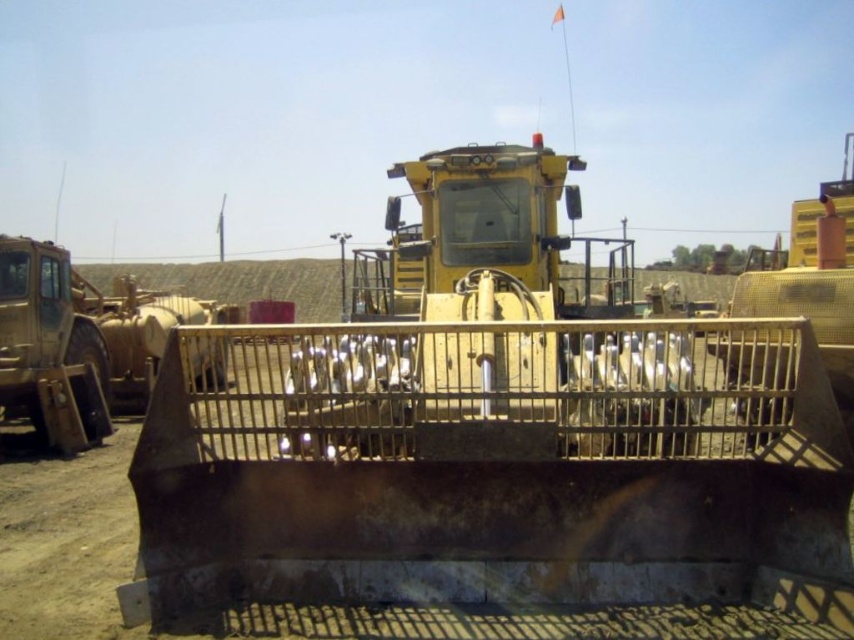
Where is `metallic/textured rail at center`? The width and height of the screenshot is (854, 640). metallic/textured rail at center is located at coordinates (492, 388).

Based on the photo, is metallic/textured rail at center positioned behind matte yellow tractor at left?

No, metallic/textured rail at center is closer to the viewer.

Between point (458, 326) and point (15, 410), which one is positioned behind?

The point (15, 410) is behind.

Where is `metallic/textured rail at center`? The image size is (854, 640). metallic/textured rail at center is located at coordinates (492, 388).